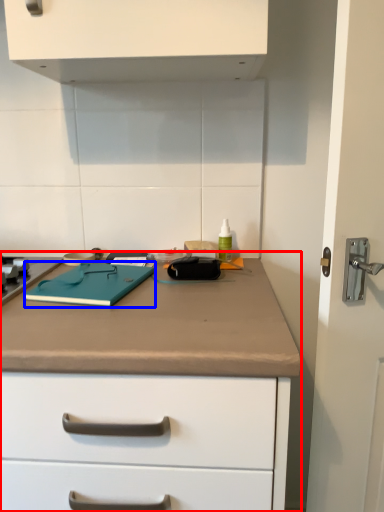
Question: Which point is further to the camera, counter (highlighted by a red box) or notebook (highlighted by a blue box)?

Choices:
 (A) counter
 (B) notebook

Answer: (B)